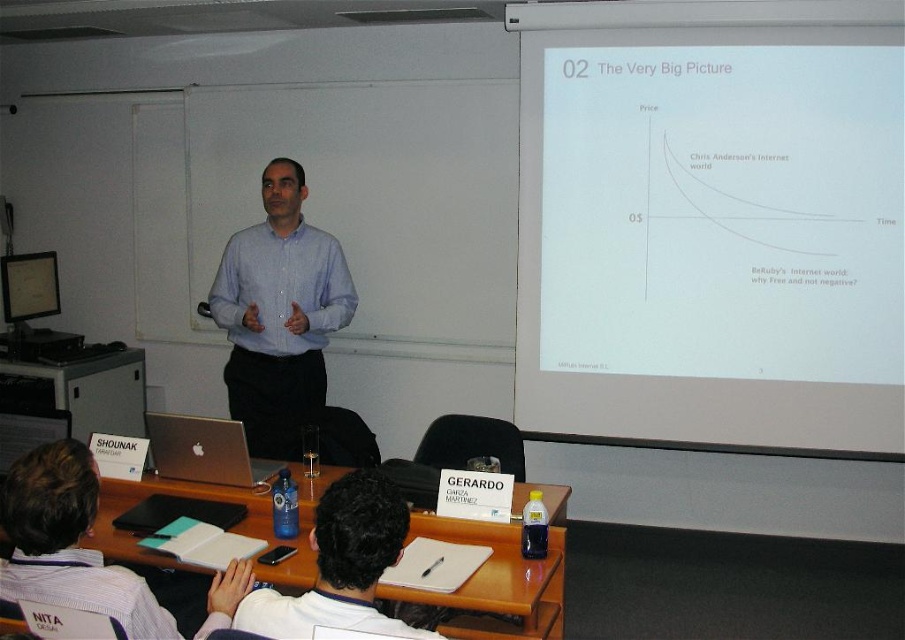
Looking at this image, you are a student sitting in the classroom. You need to hand in your assignment to the professor who is wearing the blue shirt at center. However, your laptop, which contains the assignment, is the silver metallic laptop at center. Can you reach your laptop without moving from your seat?

The blue shirt at center is located above the silver metallic laptop at center, so the laptop is below the professor. If you are sitting in the classroom, you might be able to reach the silver metallic laptop at center if it is on the desk in front of you, but the question does not provide information about the distance between your seat and the laptop.

You are a student sitting at the back of the classroom. You want to take a photo of the presenter with the projector screen in the background. The screen is on the right side of the room. Where should you position yourself to ensure both the blue shirt at center and the projector screen on the right are clearly visible in your photo?

Since the blue shirt at center is positioned at point 0.494 on the x and 0.309 on the y axis, you should position yourself centrally in the back row to capture both the presenter and the screen on the right in your photo.

You are a student sitting in the back row of the classroom. You notice the dark brown hair at center and the silver metallic laptop at center. Which object is taller from your perspective?

The dark brown hair at center is taller than the silver metallic laptop at center.